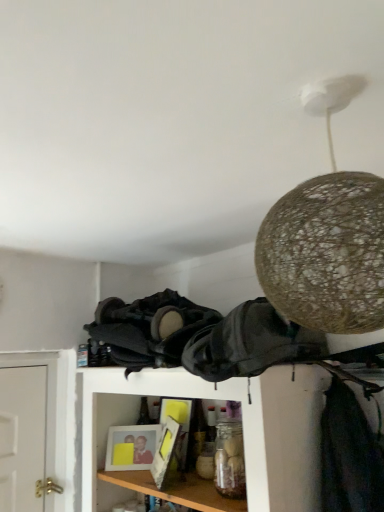
Question: Is point (135, 344) positioned closer to the camera than point (283, 291)?

Choices:
 (A) closer
 (B) farther

Answer: (B)

Question: Visually, is black fabric at center, which is the first clothing from left to right, positioned to the left or to the right of woven beige lampshade at upper right?

Choices:
 (A) left
 (B) right

Answer: (A)

Question: Which object is positioned farthest from the matte plastic picture frame at lower center?

Choices:
 (A) black leather backpack at center, which is the second clothing in left-to-right order
 (B) black fabric at center, which is the first clothing from left to right
 (C) woven beige lampshade at upper right

Answer: (C)

Question: Which of these objects is positioned closest to the woven beige lampshade at upper right?

Choices:
 (A) black leather backpack at center, which ranks as the 1th clothing in right-to-left order
 (B) black fabric at center, which is the first clothing from left to right
 (C) matte plastic picture frame at lower center

Answer: (A)